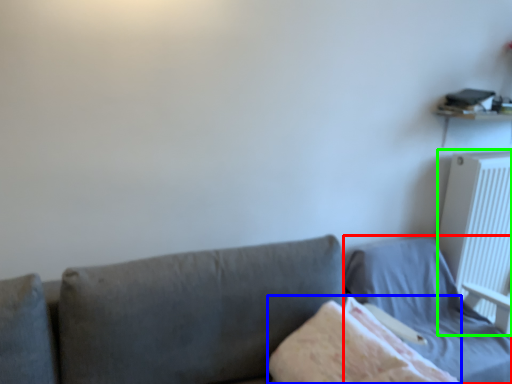
Question: Considering the real-world distances, which object is farthest from bed (highlighted by a red box)? blanket (highlighted by a blue box) or radiator (highlighted by a green box)?

Choices:
 (A) blanket
 (B) radiator

Answer: (A)